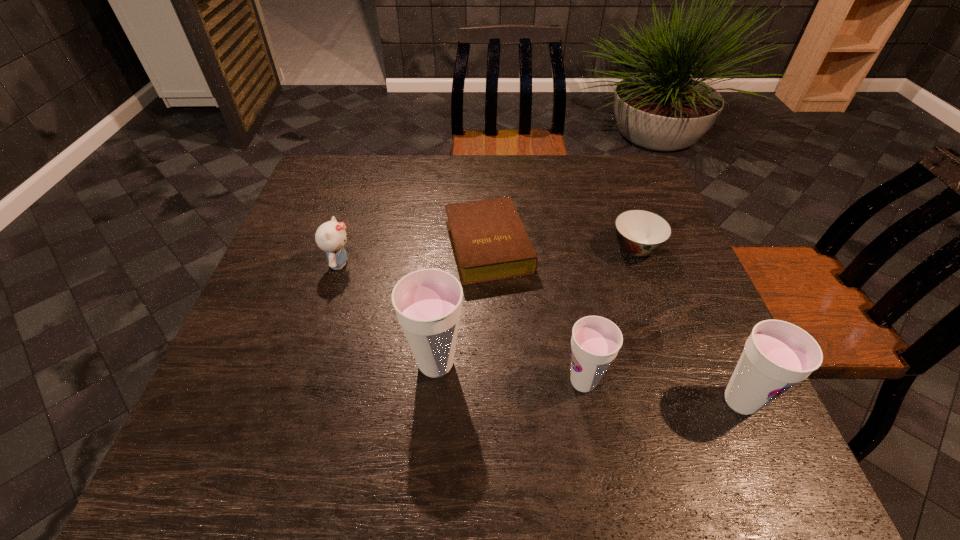
You are a GUI agent. You are given a task and a screenshot of the screen. Output one action in this format:
    pyautogui.click(x=<x>, y=<y>)
    Task: Click on the leftmost cup
    
    Given the screenshot: What is the action you would take?
    pyautogui.click(x=428, y=303)

Identify the location of the fourth object from left to right. (595, 341).

This screenshot has width=960, height=540. In order to click on the shortest cup in this screenshot , I will do `click(595, 341)`.

Find the location of a particular element. the rightmost cup is located at coordinates (777, 355).

At what (x,y) coordinates should I click in order to perform the action: click on the second shortest cup. Please return your answer as a coordinate pair (x, y). This screenshot has height=540, width=960. Looking at the image, I should click on (777, 355).

At what (x,y) coordinates should I click in order to perform the action: click on the shortest object. Please return your answer as a coordinate pair (x, y). The height and width of the screenshot is (540, 960). Looking at the image, I should click on (489, 242).

Find the location of a particular element. This screenshot has width=960, height=540. kitten is located at coordinates [331, 236].

Where is `the fourth tallest object`? the fourth tallest object is located at coordinates (331, 236).

Locate an element on the screen. the fifth tallest object is located at coordinates (640, 233).

Identify the location of vacant area situated 0.270m on the right of the leftmost cup. (601, 363).